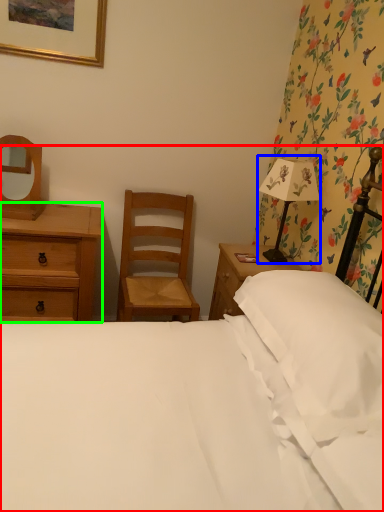
Question: Considering the real-world distances, which object is farthest from bed (highlighted by a red box)? bedside lamp (highlighted by a blue box) or chest of drawers (highlighted by a green box)?

Choices:
 (A) bedside lamp
 (B) chest of drawers

Answer: (B)